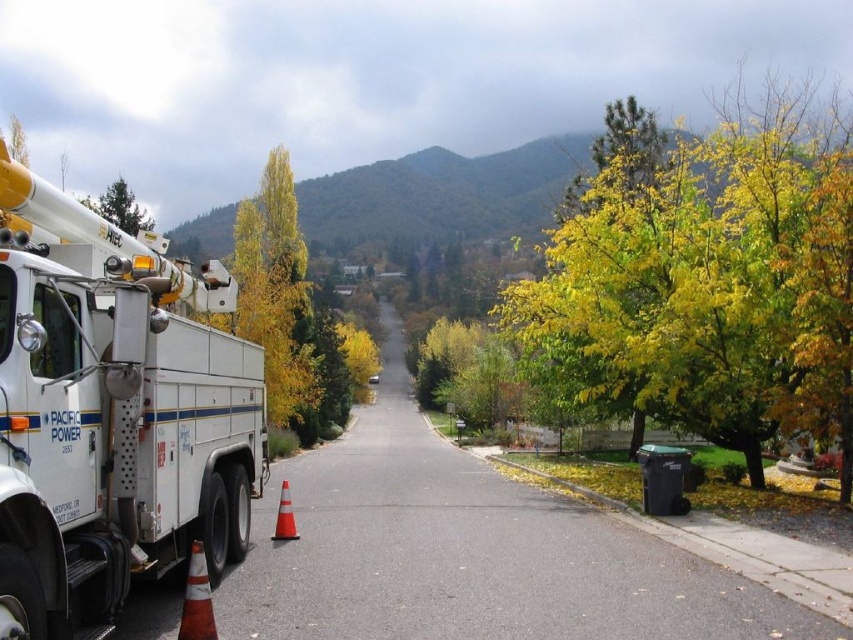
You are a delivery driver approaching the suburban street scene. You notice the Pacific Power utility truck parked on the left side of the road with its boom extended. There are two orange traffic cones near the truck. You also see a point marked at coordinates [711,278] which indicates yellow golden leaves at upper right. Considering the location of the leaves, would they be visible in your rearview mirror as you drive past the truck?

The point marked at coordinates [711,278] indicates yellow golden leaves at upper right, which are located in the upper right area of the image. Since the Pacific Power utility truck is parked on the left side of the road, the leaves at upper right would likely be visible in your rearview mirror as you drive past the truck because they are positioned opposite to the truck and above the driver.

You are a pedestrian walking along the suburban street and notice the orange reflective cone at lower left and the green leafy tree at upper left. Which object is shorter?

The orange reflective cone at lower left is not as tall as the green leafy tree at upper left, so the orange reflective cone at lower left is shorter.